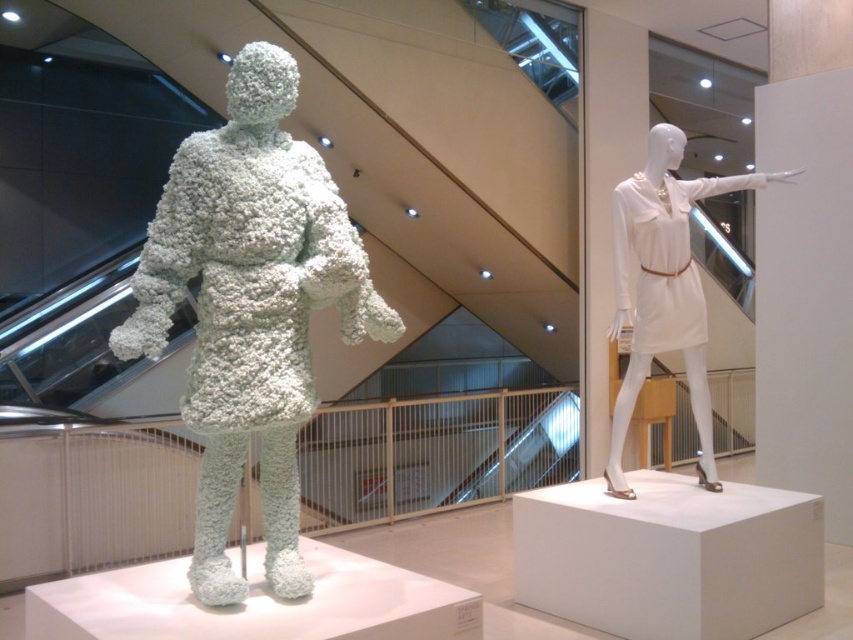
You are an art curator planning to rearrange the sculptures in the gallery. If you want to place a new sculpture between the white fluffy sculpture at left and the white matte dress at right, where should you position it?

You should position the new sculpture between the white fluffy sculpture at left and the white matte dress at right, as the white fluffy sculpture at left is already on the left side of the white matte dress at right.

You are an art curator planning to install a new lighting system in the gallery. The white fluffy sculpture at left and the white matte dress at right are both on display. Since the fluffy sculpture is less reflective, you want to place a spotlight closer to it to ensure visibility. However, the dress is taller. Which object should you place the spotlight closer to, and why?

The white fluffy sculpture at left is not as tall as the white matte dress at right. Therefore, the spotlight should be placed closer to the white fluffy sculpture at left because it is shorter and requires more focused lighting to enhance its visibility without overshadowing the taller dress.